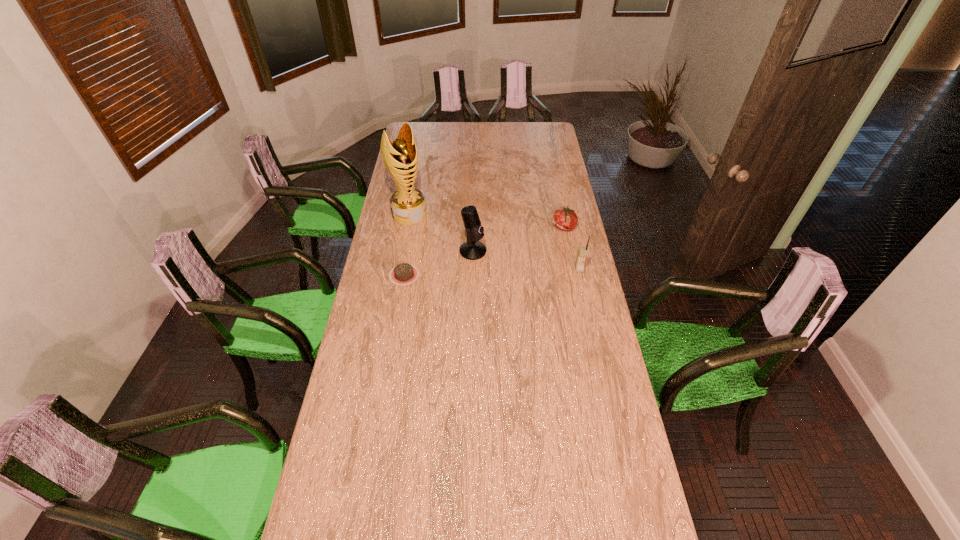
Where is `blank region between the microphone and the award`? This screenshot has height=540, width=960. blank region between the microphone and the award is located at coordinates (x=442, y=232).

Where is `vacant area that lies between the award and the cellular telephone`? vacant area that lies between the award and the cellular telephone is located at coordinates click(494, 242).

The width and height of the screenshot is (960, 540). What are the coordinates of `free space between the shortest object and the third tallest object` in the screenshot? It's located at (492, 272).

Locate an element on the screen. The width and height of the screenshot is (960, 540). vacant region between the third shortest object and the tomato is located at coordinates (572, 248).

Identify which object is the fourth closest to the microphone. Please provide its 2D coordinates. Your answer should be formatted as a tuple, i.e. [(x, y)], where the tuple contains the x and y coordinates of a point satisfying the conditions above.

[(582, 252)]

Identify which object is the closest to the cellular telephone. Please provide its 2D coordinates. Your answer should be formatted as a tuple, i.e. [(x, y)], where the tuple contains the x and y coordinates of a point satisfying the conditions above.

[(566, 219)]

At what (x,y) coordinates should I click in order to perform the action: click on vacant point that satisfies the following two spatial constraints: 1. on the back side of the third object from right to left; 2. on the left side of the chocolate cake. Please return your answer as a coordinate pair (x, y). Image resolution: width=960 pixels, height=540 pixels. Looking at the image, I should click on (408, 251).